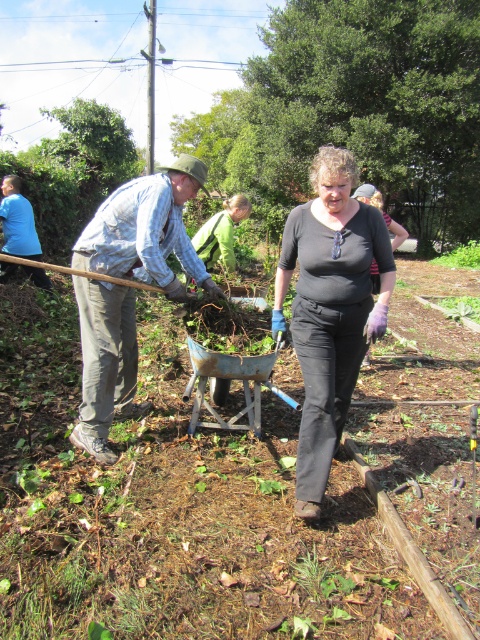
The width and height of the screenshot is (480, 640). In order to click on black matte shirt at center in this screenshot , I will do `click(330, 308)`.

Can you confirm if denim shirt at center is positioned to the left of green fabric at center?

Indeed, denim shirt at center is positioned on the left side of green fabric at center.

How far apart are denim shirt at center and green fabric at center?

The distance of denim shirt at center from green fabric at center is 2.35 meters.

Describe the element at coordinates (146, 230) in the screenshot. I see `denim shirt at center` at that location.

Find the location of a particular element. This screenshot has height=640, width=480. denim shirt at center is located at coordinates point(146,230).

Which is in front, point (241, 216) or point (447, 257)?

Point (241, 216)

Where is `green fabric at center`? green fabric at center is located at coordinates (220, 234).